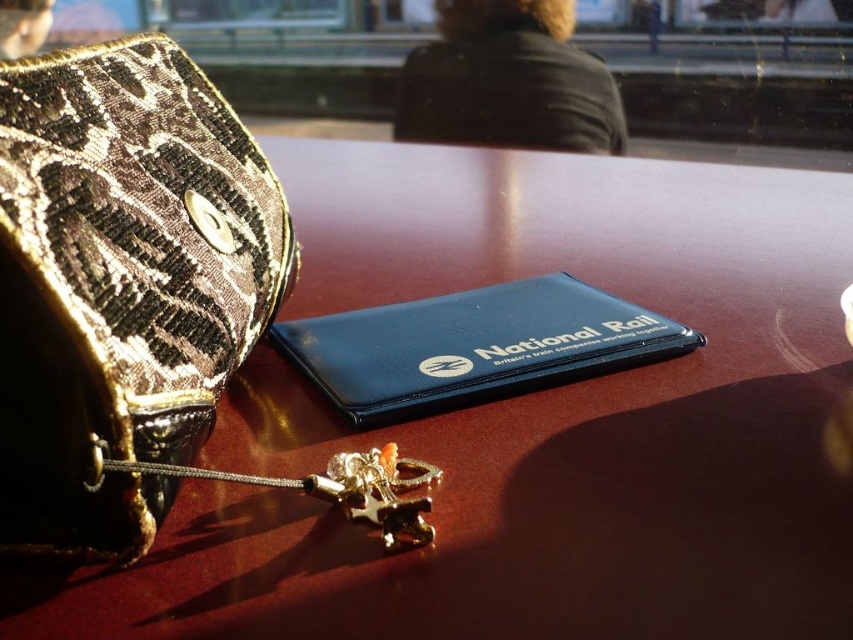
Question: Does matte black wallet at center appear over gold metallic key at center?

Choices:
 (A) no
 (B) yes

Answer: (B)

Question: Estimate the real-world distances between objects in this image. Which object is farther from the leather textured bag at left?

Choices:
 (A) gold metallic key at center
 (B) matte black wallet at center

Answer: (A)

Question: Which of the following is the closest to the observer?

Choices:
 (A) matte black wallet at center
 (B) gold metallic key at center

Answer: (B)

Question: Based on their relative distances, which object is farther from the leather textured bag at left?

Choices:
 (A) matte black wallet at center
 (B) gold metallic key at center

Answer: (B)

Question: From the image, what is the correct spatial relationship of leather textured bag at left in relation to matte black wallet at center?

Choices:
 (A) above
 (B) below

Answer: (A)

Question: Observing the image, what is the correct spatial positioning of leather textured bag at left in reference to gold metallic key at center?

Choices:
 (A) above
 (B) below

Answer: (A)